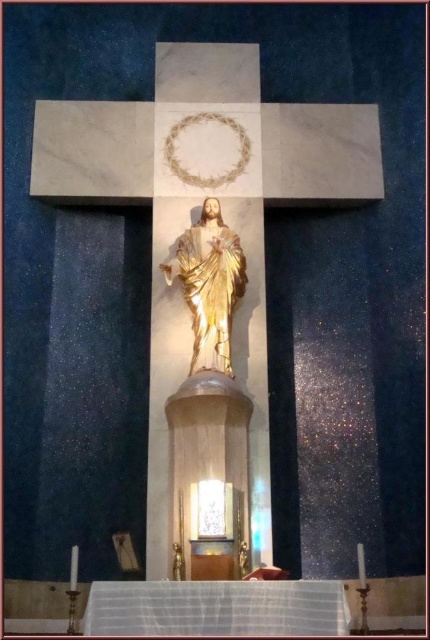
You are a visitor standing in front of the altar. You notice two statues at the center. Which one is closer to you, the gold leaf statue at center or the gold polished statue at center?

The gold leaf statue at center is closer to you because it is further to the viewer than the gold polished statue at center.

You are an art conservator assessing the dimensions of the statues in the altar. Given that the gold leaf statue at center and the gold polished statue at center are both central to the composition, which one has a greater width?

The gold leaf statue at center has a greater width than the gold polished statue at center according to the description provided.